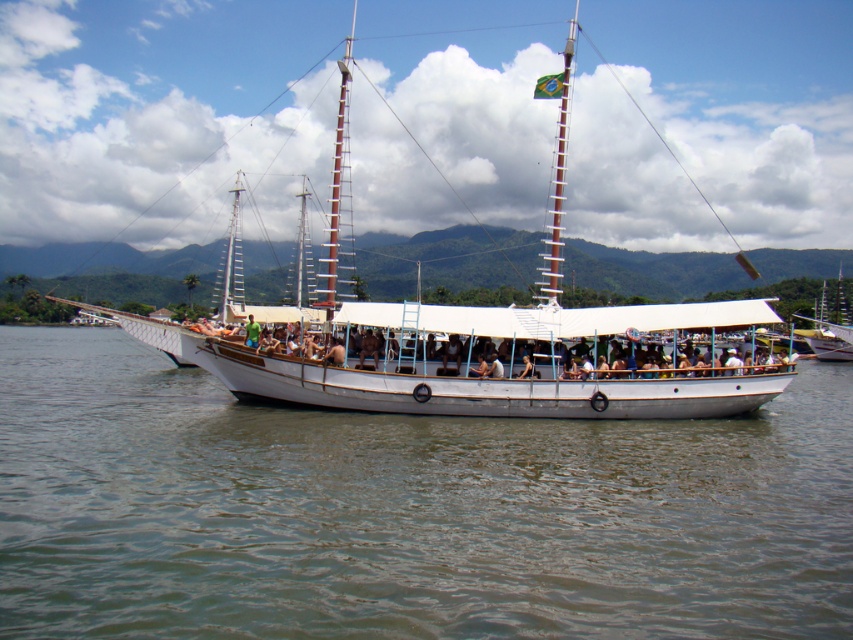
You are a passenger on the white wooden boat at center. You want to see the clear water at center. In which direction should you look from your position on the boat?

The clear water at center is below the white wooden boat at center, so you should look downward to see it.

You are a passenger on the boat and want to know if the clear water at center is deeper than the white wooden boat at center. Can you determine this based on the scene?

The clear water at center has a lesser height compared to white wooden boat at center, so the water is not deeper than the boat.